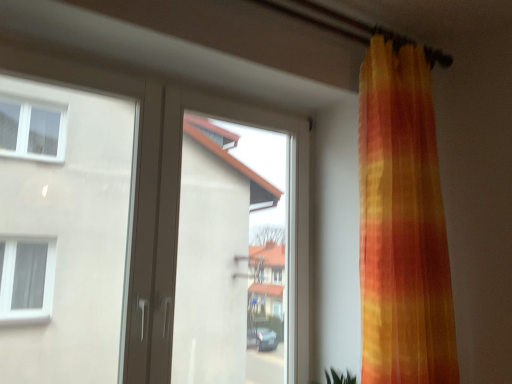
Question: From a real-world perspective, is matte brown door at left positioned above or below transparent glass window at center?

Choices:
 (A) above
 (B) below

Answer: (A)

Question: Considering the positions of point (223, 160) and point (222, 215), is point (223, 160) closer or farther from the camera than point (222, 215)?

Choices:
 (A) closer
 (B) farther

Answer: (B)

Question: From the image's perspective, relative to transparent glass window at center, is matte brown door at left above or below?

Choices:
 (A) below
 (B) above

Answer: (B)

Question: In the image, is transparent glass window at center positioned in front of or behind matte brown door at left?

Choices:
 (A) behind
 (B) front

Answer: (A)

Question: Is point (179, 150) positioned closer to the camera than point (74, 360)?

Choices:
 (A) closer
 (B) farther

Answer: (A)

Question: From a real-world perspective, is transparent glass window at center positioned above or below matte brown door at left?

Choices:
 (A) below
 (B) above

Answer: (A)

Question: From the image's perspective, is transparent glass window at center above or below matte brown door at left?

Choices:
 (A) above
 (B) below

Answer: (B)